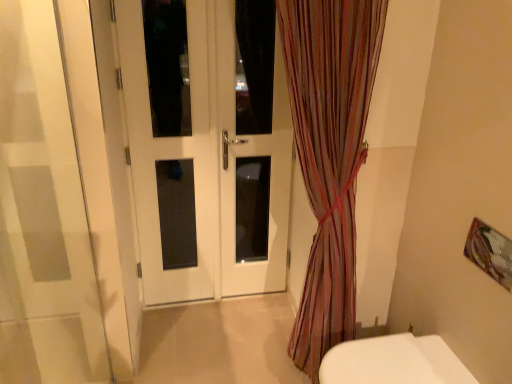
Find the location of a particular element. The width and height of the screenshot is (512, 384). vacant space to the left of white glass door at center is located at coordinates (205, 321).